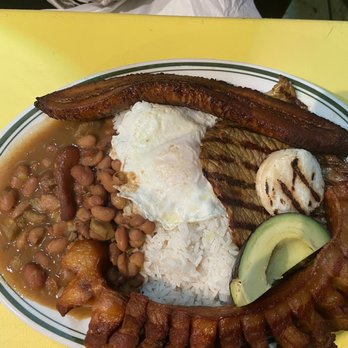
Image resolution: width=348 pixels, height=348 pixels. I want to click on green trim on rim of plate, so click(76, 339).